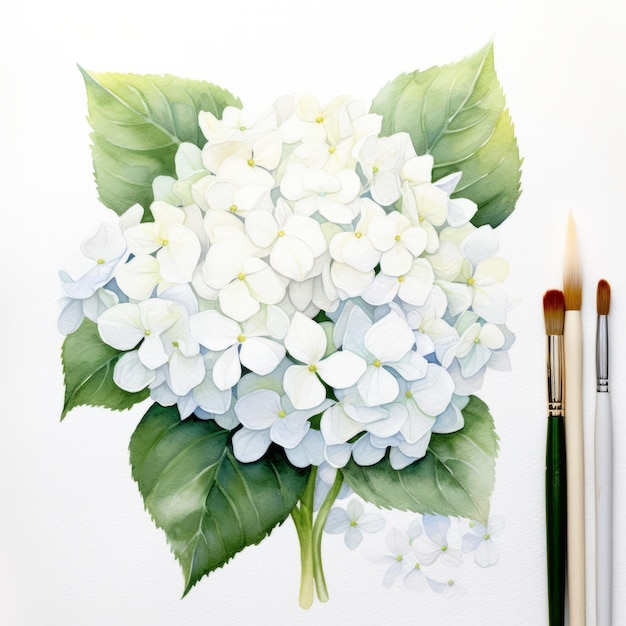
This screenshot has width=626, height=626. What are the coordinates of `painting` in the screenshot? It's located at [422, 206].